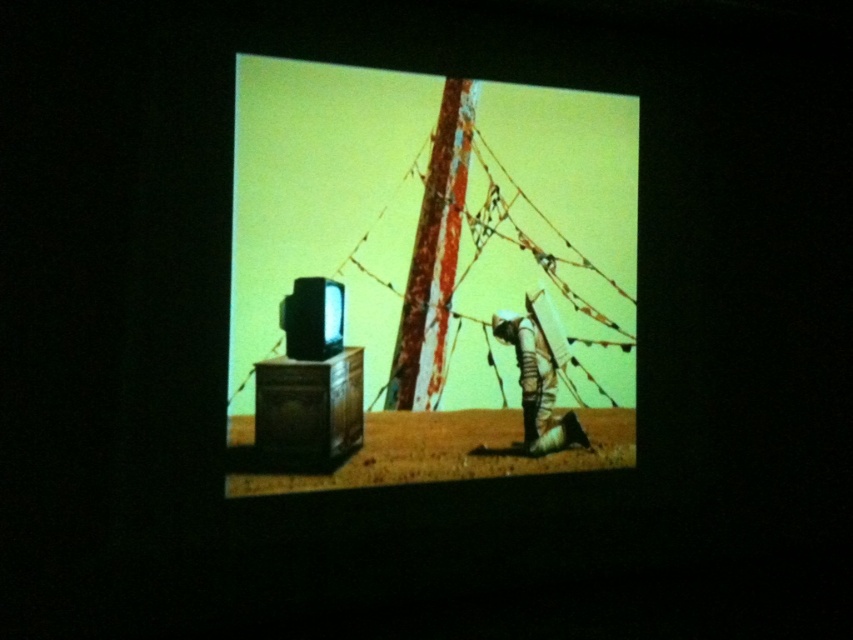
Can you confirm if metallic silver tv at center-left is positioned below camouflage fabric person at center?

Incorrect, metallic silver tv at center-left is not positioned below camouflage fabric person at center.

Is metallic silver tv at center-left bigger than camouflage fabric person at center?

Yes.

Which is behind, point (579, 157) or point (573, 433)?

The point (579, 157) is more distant.

Find the location of a particular element. This screenshot has width=853, height=640. metallic silver tv at center-left is located at coordinates (434, 273).